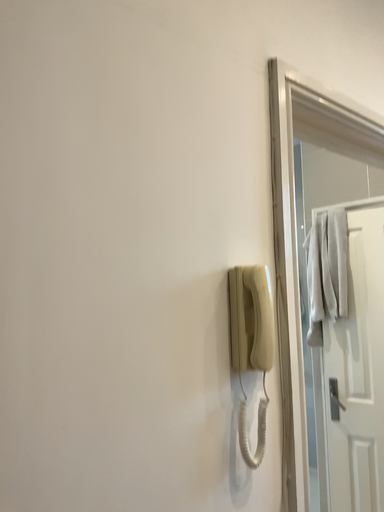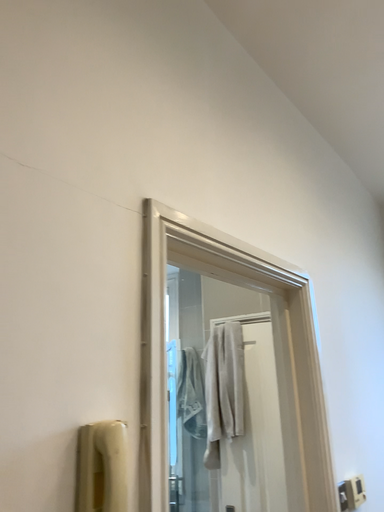
Question: How did the camera likely rotate when shooting the video?

Choices:
 (A) rotated left
 (B) rotated right

Answer: (B)